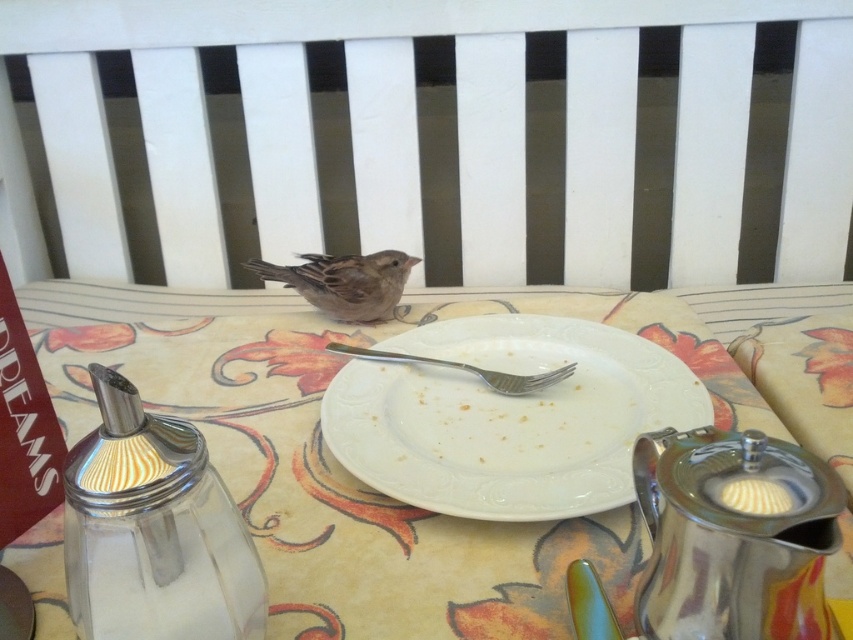
You are a guest at a garden party and spot a white porcelain plate at center and a brown feathered sparrow at center. Which object is positioned lower in the scene?

The white porcelain plate at center is positioned lower than the brown feathered sparrow at center according to the description.

Where is the white porcelain plate at center located in the coordinate system?

The white porcelain plate at center is located at point [508,417] in the coordinate system.

You are a birdwatcher who wants to observe the brown feathered sparrow at center without disturbing it. The white ceramic plate at center is in the way. Can you move the plate to the side to get a better view?

The white ceramic plate at center has a larger size compared to brown feathered sparrow at center, so moving the plate might be necessary to avoid disturbing the sparrow. However, since the plate is larger, it could block the view if not moved properly. Carefully moving it aside would allow a clearer observation without causing disruption.